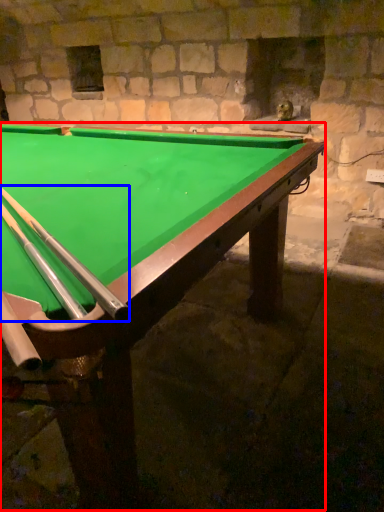
Question: Which object is closer to the camera taking this photo, billiard table (highlighted by a red box) or cue (highlighted by a blue box)?

Choices:
 (A) billiard table
 (B) cue

Answer: (A)